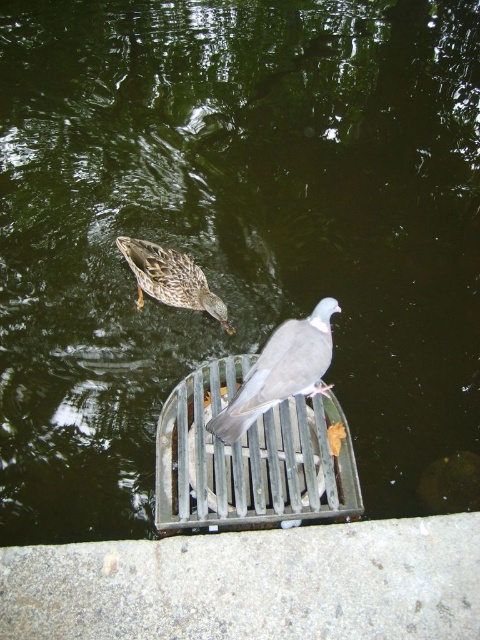
Question: Among these objects, which one is nearest to the camera?

Choices:
 (A) gray matte pigeon at center
 (B) brown speckled feathers at upper center

Answer: (A)

Question: Can you confirm if gray matte pigeon at center is positioned above brown speckled feathers at upper center?

Choices:
 (A) yes
 (B) no

Answer: (B)

Question: Which point is farther from the camera taking this photo?

Choices:
 (A) (254, 413)
 (B) (166, 269)

Answer: (B)

Question: Does gray matte pigeon at center appear on the right side of brown speckled feathers at upper center?

Choices:
 (A) yes
 (B) no

Answer: (A)

Question: Observing the image, what is the correct spatial positioning of gray matte pigeon at center in reference to brown speckled feathers at upper center?

Choices:
 (A) above
 (B) below

Answer: (B)